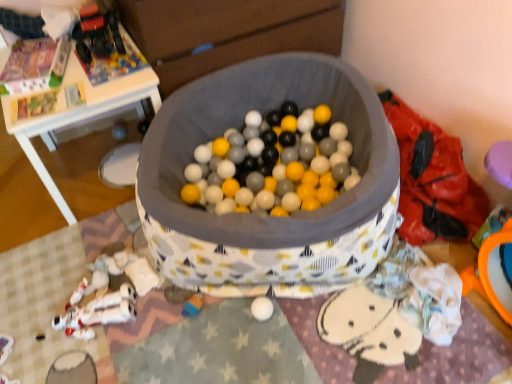
Locate an element on the screen. This screenshot has height=384, width=512. vacant space in front of white plastic toy at lower left, the 2th toy ordered from the bottom is located at coordinates (93, 362).